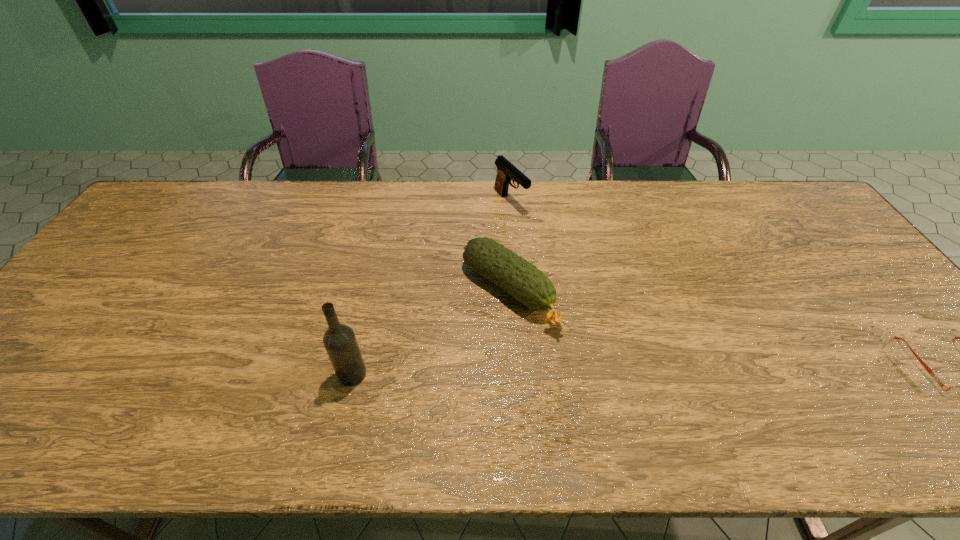
Where is `free space on the desktop that is between the leftmost object and the shortest object and is positioned at the barrel of the pistol`? free space on the desktop that is between the leftmost object and the shortest object and is positioned at the barrel of the pistol is located at coordinates (684, 370).

At what (x,y) coordinates should I click in order to perform the action: click on vacant spot on the desktop that is between the vodka and the shortest object and is positioned at the blossom end of the second shortest object. Please return your answer as a coordinate pair (x, y). Looking at the image, I should click on (x=609, y=371).